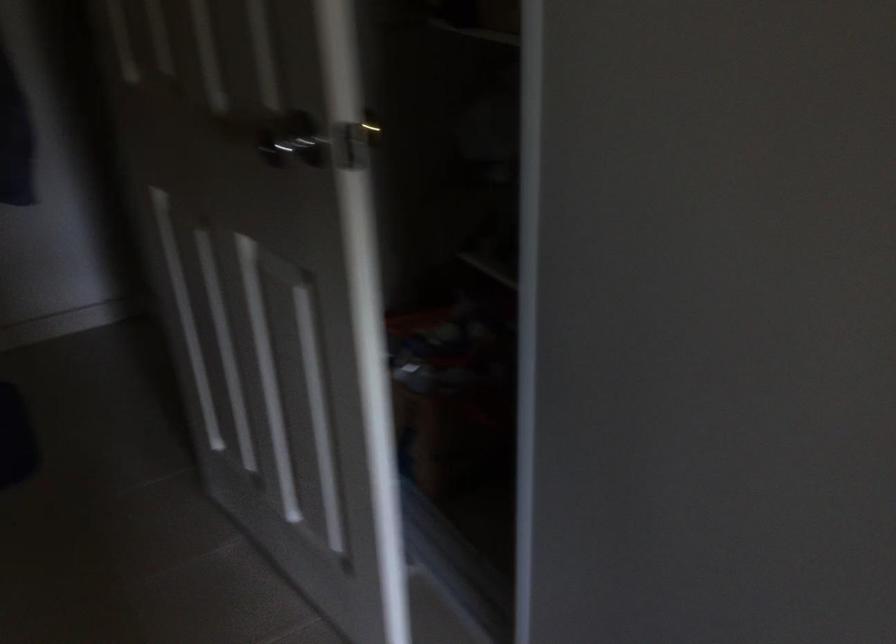
Find where to turn the metal door knob. Please return your answer as a coordinate pair (x, y).

(293, 149)